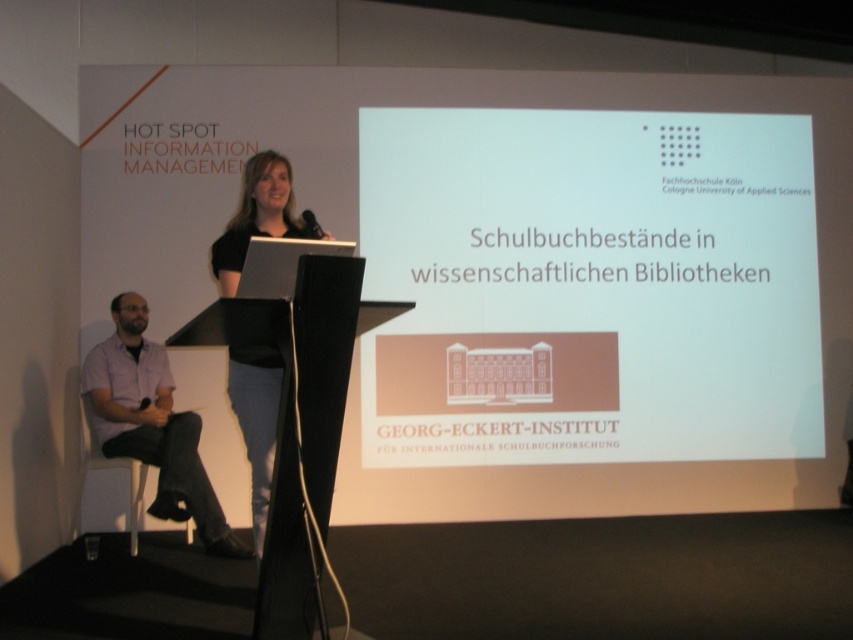
You are sitting in the front row of the conference hall and want to hand a note to the speaker who is at the podium. There is a black matte laptop at center and a white plastic chair at lower left in your line of sight. Which object is closer to you?

The black matte laptop at center is closer to the viewer than the white plastic chair at lower left, so the black matte laptop at center is closer to you.

You are an event organizer setting up the conference room. You need to ensure that the black matte laptop at center and the matte black microphone at upper center are visible to the audience. Given their sizes, which object should be placed closer to the front of the stage to ensure visibility?

The matte black microphone at upper center should be placed closer to the front of the stage because it is smaller in size compared to the black matte laptop at center. This ensures that the smaller microphone remains visible to the audience despite its reduced size.

You are an attendee sitting in the front row of the conference. You notice the black matte laptop at center and the matte black microphone at upper center on the podium. How far apart are these two items?

The black matte laptop at center is 17.84 inches away from the matte black microphone at upper center.